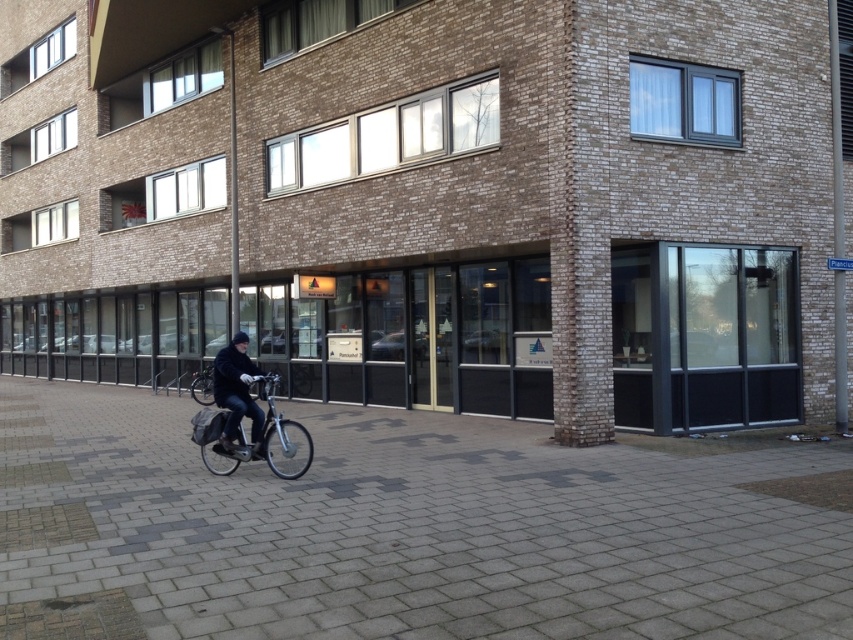
You are a delivery person who needs to park your silver metallic bicycle at lower left near the dark blue jacket at center. Considering their sizes, will the bicycle fit in the space where the jacket is currently located?

The silver metallic bicycle at lower left is wider than the dark blue jacket at center, so it may not fit in the space where the jacket is currently located unless there is additional room available.